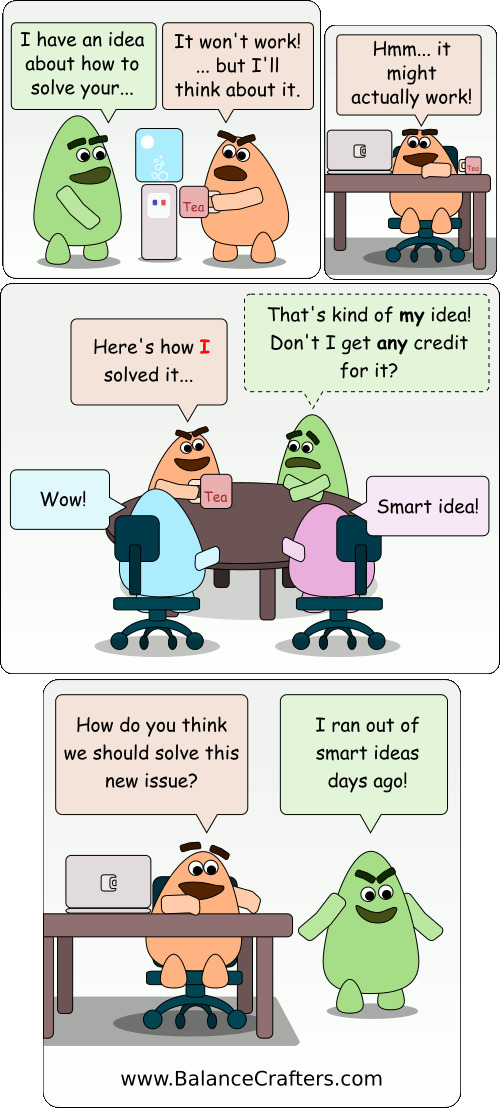
Locate an element on the screen. The image size is (500, 1108). laptop is located at coordinates (359, 153), (104, 883).